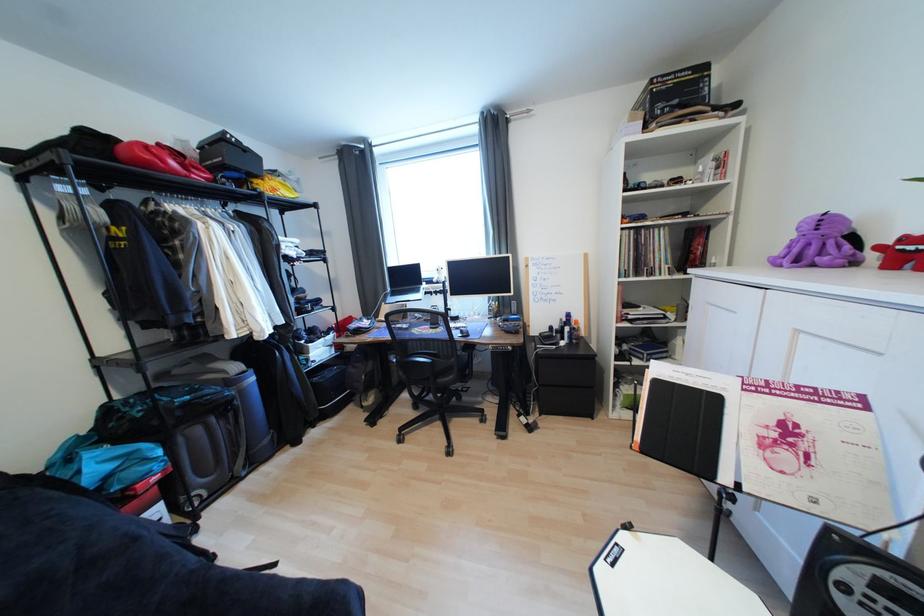
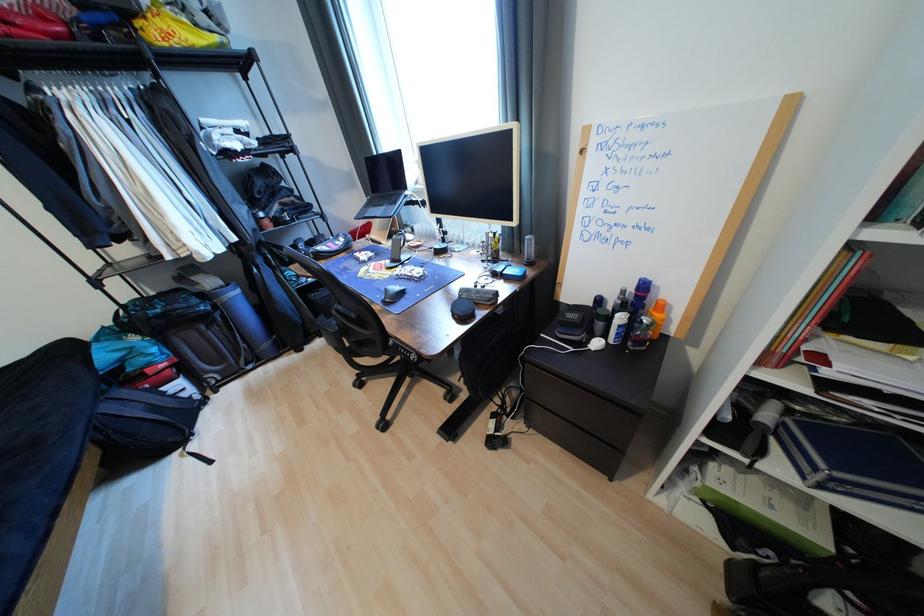
The point at (302, 196) is marked in the first image. Where is the corresponding point in the second image?

(223, 39)